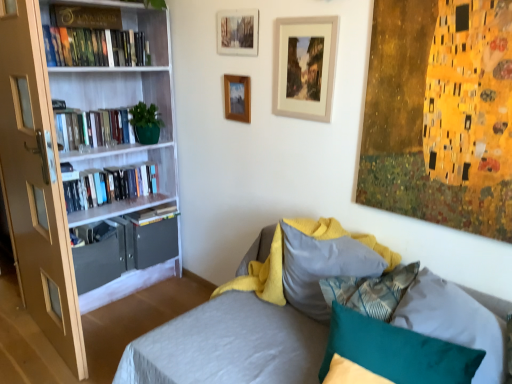
At what (x,y) coordinates should I click in order to perform the action: click on free space above gold metallic sign at upper left, which is the 5th book from bottom to top (from a real-world perspective). Please return your answer as a coordinate pair (x, y). Image resolution: width=512 pixels, height=384 pixels. Looking at the image, I should click on (87, 8).